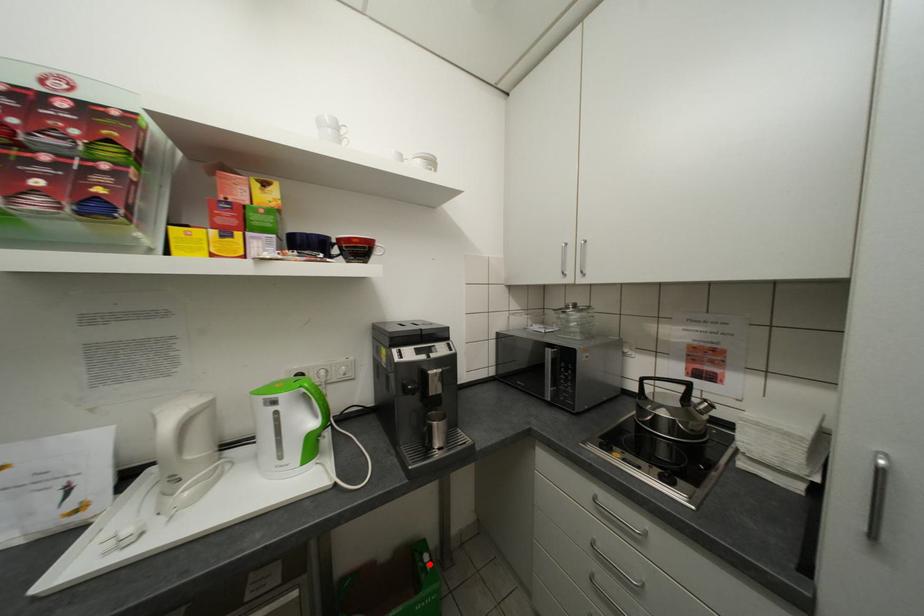
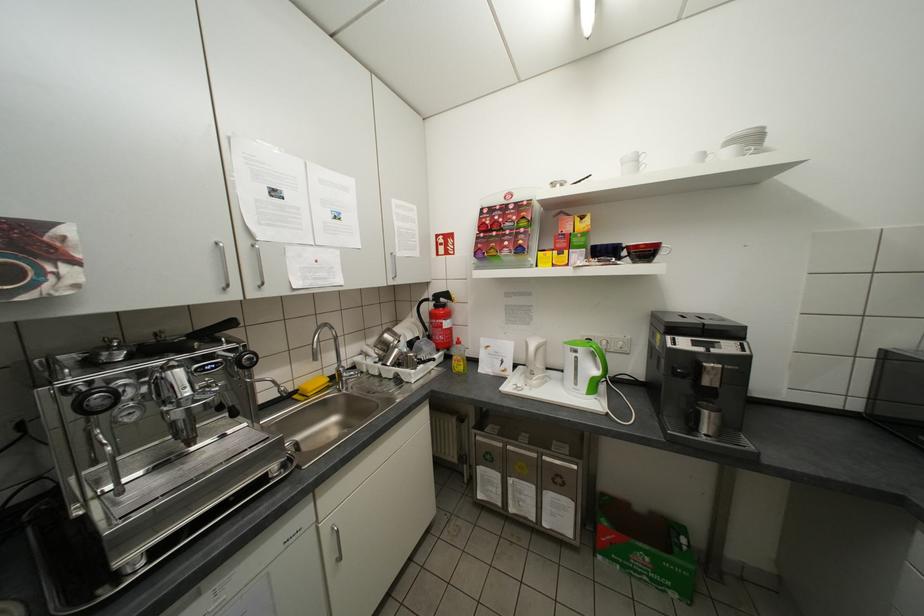
Locate, in the second image, the point that corresponds to the highlighted location in the first image.

(685, 541)